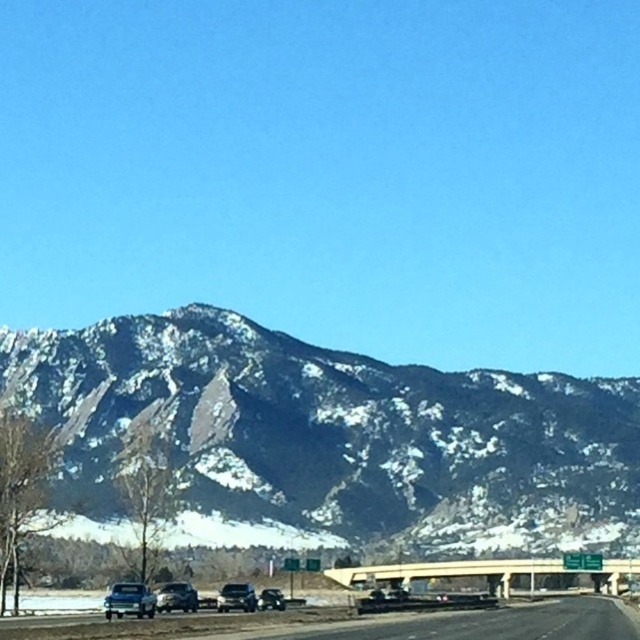
You are a delivery driver navigating through the mountainous area and need to stay on the asphalt road at lower center. According to the map, the overpass ahead is at point 0.977, 0.577. Is the road you are on leading towards the overpass?

The asphalt road at lower center is located at point [369,625], so yes, the road you are on is leading towards the overpass at that coordinate.

You are a passenger in the shiny silver sedan at lower left and want to know if you can see the shiny black sedan at center through the rearview mirror. Based on their positions, can you see it?

The shiny silver sedan at lower left is positioned over the shiny black sedan at center, so it is blocking the view. Therefore, you cannot see the shiny black sedan at center through the rearview mirror.